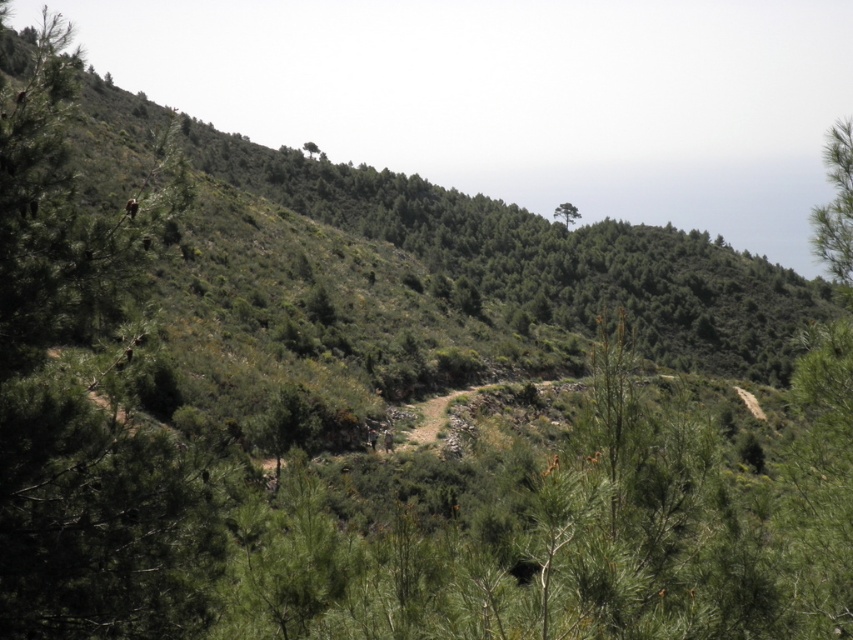
Find the location of a particular element. green leafy tree at upper right is located at coordinates (836, 208).

From the picture: Who is more forward, (838, 220) or (567, 205)?

Point (838, 220) is more forward.

Is point (846, 160) closer to viewer compared to point (566, 212)?

That is True.

Identify the location of green leafy tree at upper right. (836, 208).